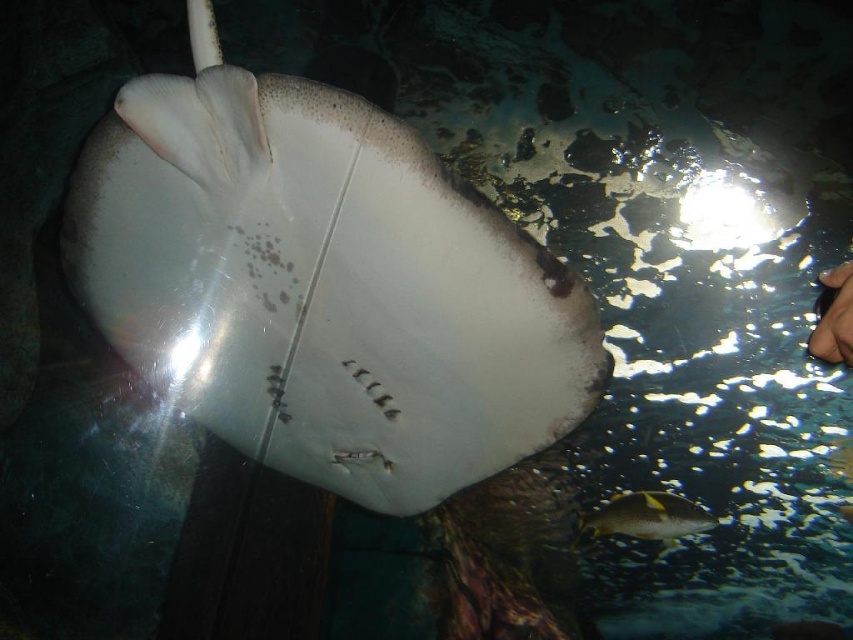
Who is positioned more to the right, white smooth stingray at center or yellow-orange textured fish at lower right?

yellow-orange textured fish at lower right is more to the right.

Can you confirm if white smooth stingray at center is shorter than yellow-orange textured fish at lower right?

In fact, white smooth stingray at center may be taller than yellow-orange textured fish at lower right.

Who is more distant from viewer, (595, 333) or (660, 499)?

The point (660, 499) is behind.

Locate an element on the screen. white smooth stingray at center is located at coordinates (323, 288).

Can you confirm if white smooth stingray at center is wider than smooth skin hand at upper right?

Correct, the width of white smooth stingray at center exceeds that of smooth skin hand at upper right.

Identify the location of white smooth stingray at center. The image size is (853, 640). (323, 288).

Which is in front, point (606, 502) or point (848, 262)?

Point (848, 262)

Who is shorter, yellow-orange textured fish at lower right or smooth skin hand at upper right?

Standing shorter between the two is smooth skin hand at upper right.

Between point (604, 524) and point (833, 308), which one is positioned in front?

Point (833, 308) is in front.

Where is `yellow-orange textured fish at lower right`? This screenshot has height=640, width=853. yellow-orange textured fish at lower right is located at coordinates pyautogui.click(x=646, y=516).